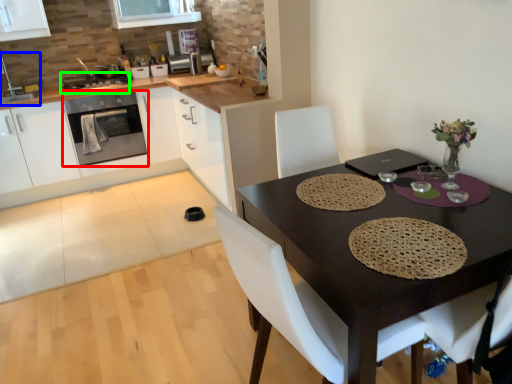
Question: Which object is the closest to the kitchen appliance (highlighted by a red box)? Choose among these: sink (highlighted by a blue box) or appliance (highlighted by a green box).

Choices:
 (A) sink
 (B) appliance

Answer: (B)